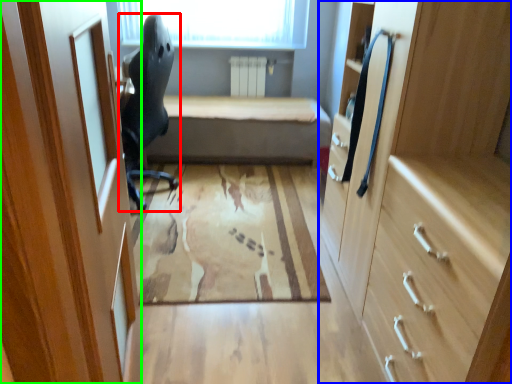
Question: Which is farther away from chair (highlighted by a red box)? cabinetry (highlighted by a blue box) or door (highlighted by a green box)?

Choices:
 (A) cabinetry
 (B) door

Answer: (A)